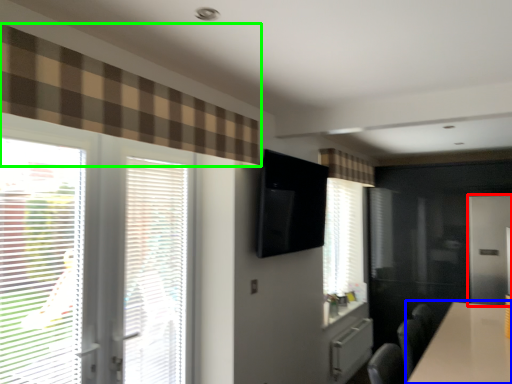
Question: Which object is positioned closest to screen door (highlighted by a red box)? Select from table (highlighted by a blue box) and curtain (highlighted by a green box).

Choices:
 (A) table
 (B) curtain

Answer: (A)